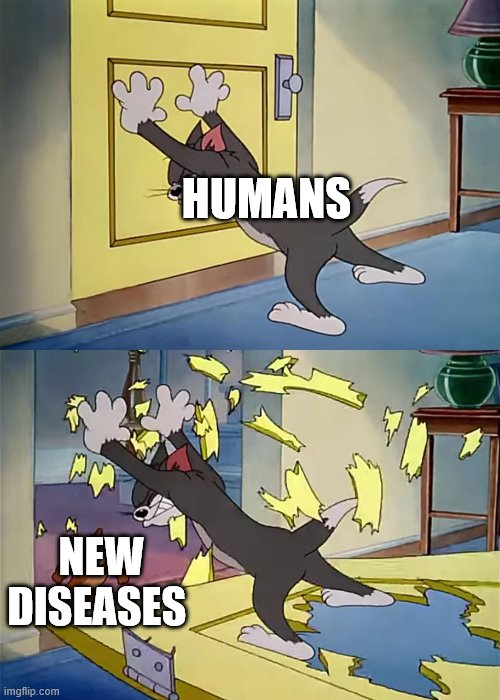
Identify the location of lamp. (465, 400).